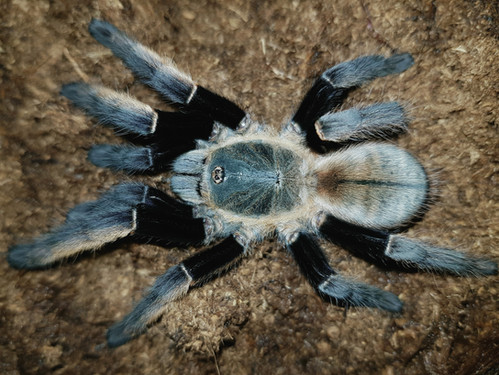
Where is `surface`? surface is located at coordinates (433, 74), (39, 54), (71, 333), (245, 42), (196, 307), (452, 308).